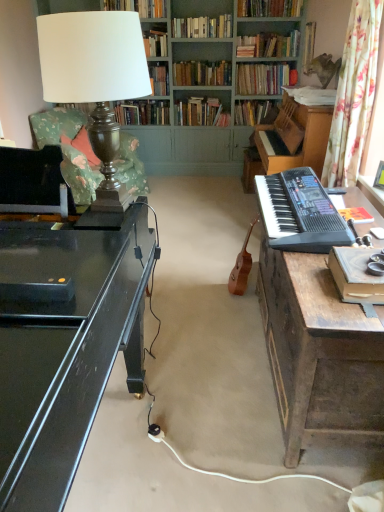
Identify the location of free spot above hardcover book at upper right, acting as the second book starting from the front (from a real-world perspective). (315, 92).